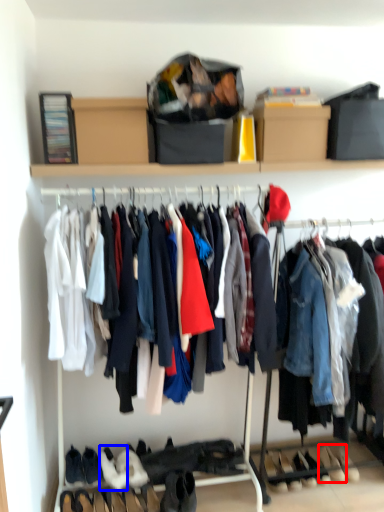
Question: Which of the following is the farthest to the observer, footwear (highlighted by a red box) or footwear (highlighted by a blue box)?

Choices:
 (A) footwear
 (B) footwear

Answer: (A)